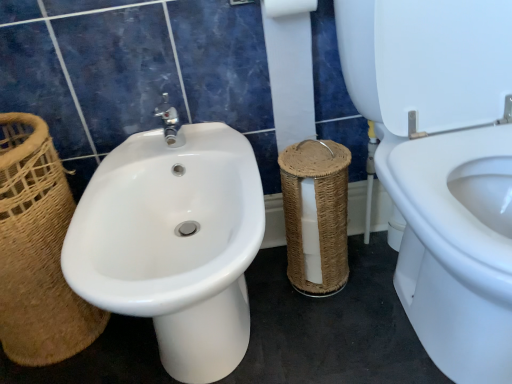
This screenshot has height=384, width=512. Identify the location of free space to the left of woven brown basket at center. [269, 294].